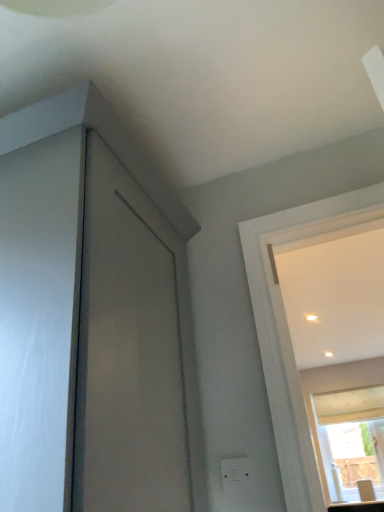
Question: Is white plastic electric outlet at lower center taller or shorter than transparent glass window at upper right?

Choices:
 (A) short
 (B) tall

Answer: (A)

Question: Which is correct: white plastic electric outlet at lower center is inside transparent glass window at upper right, or outside of it?

Choices:
 (A) inside
 (B) outside

Answer: (B)

Question: Which of these objects is positioned closest to the white plastic electric outlet at lower center?

Choices:
 (A) transparent glass window at upper right
 (B) matte white countertop at lower right

Answer: (B)

Question: Considering the real-world distances, which object is closest to the matte white countertop at lower right?

Choices:
 (A) white plastic electric outlet at lower center
 (B) transparent glass window at upper right

Answer: (B)